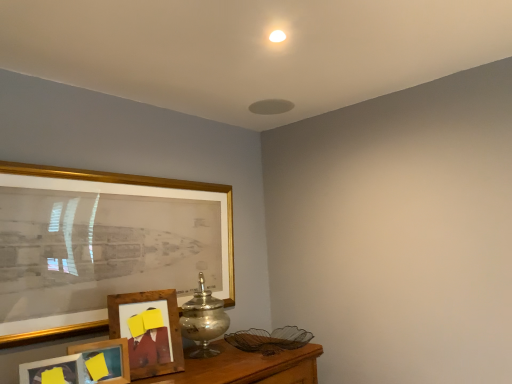
Question: From a real-world perspective, relative to wooden picture frame at lower left, positioned as the fourth picture frame in front-to-back order, is gold framed picture at left, which is the third picture frame from front to back, vertically above or below?

Choices:
 (A) above
 (B) below

Answer: (A)

Question: In terms of height, does gold framed picture at left, the second picture frame in the back-to-front sequence, look taller or shorter compared to wooden picture frame at lower left, positioned as the fourth picture frame in front-to-back order?

Choices:
 (A) short
 (B) tall

Answer: (B)

Question: Based on their relative distances, which object is nearer to the wooden photo frame at lower left, the third picture frame viewed from the back?

Choices:
 (A) wooden picture frame at lower left, positioned as the fourth picture frame in front-to-back order
 (B) gold framed picture at left, which is the third picture frame from front to back
 (C) wooden photo frame at lower left, which is counted as the fourth picture frame, starting from the back
 (D) silver metallic vase at center

Answer: (C)

Question: Which object is positioned closest to the wooden photo frame at lower left, marked as the 1th picture frame in a front-to-back arrangement?

Choices:
 (A) wooden photo frame at lower left, the second picture frame from the front
 (B) wooden picture frame at lower left, which appears as the 1th picture frame when viewed from the back
 (C) silver metallic vase at center
 (D) gold framed picture at left, the second picture frame in the back-to-front sequence

Answer: (A)